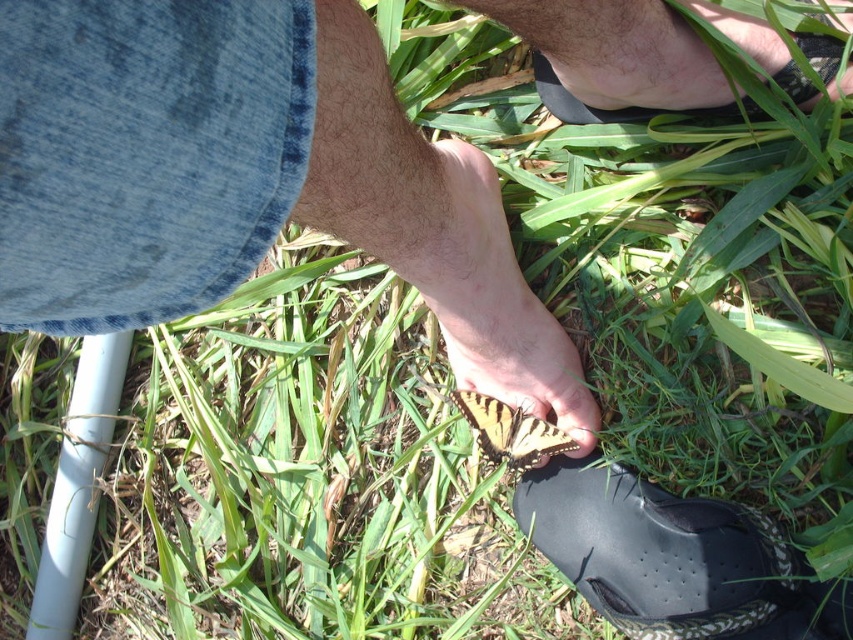
Question: Is black rubber shoe at lower right bigger than black rubber shoe at upper right?

Choices:
 (A) yes
 (B) no

Answer: (A)

Question: Which object is the closest to the black rubber shoe at lower right?

Choices:
 (A) yellow-black butterfly at center
 (B) black rubber shoe at upper right

Answer: (A)

Question: Does black rubber shoe at lower right appear under yellow-black butterfly at center?

Choices:
 (A) yes
 (B) no

Answer: (A)

Question: Which of the following is the farthest from the observer?

Choices:
 (A) (486, 356)
 (B) (735, 605)

Answer: (A)

Question: Is black rubber shoe at lower right closer to camera compared to black rubber shoe at upper right?

Choices:
 (A) no
 (B) yes

Answer: (B)

Question: Which object appears farthest from the camera in this image?

Choices:
 (A) black rubber shoe at upper right
 (B) black rubber shoe at lower right
 (C) yellow-black butterfly at center

Answer: (A)